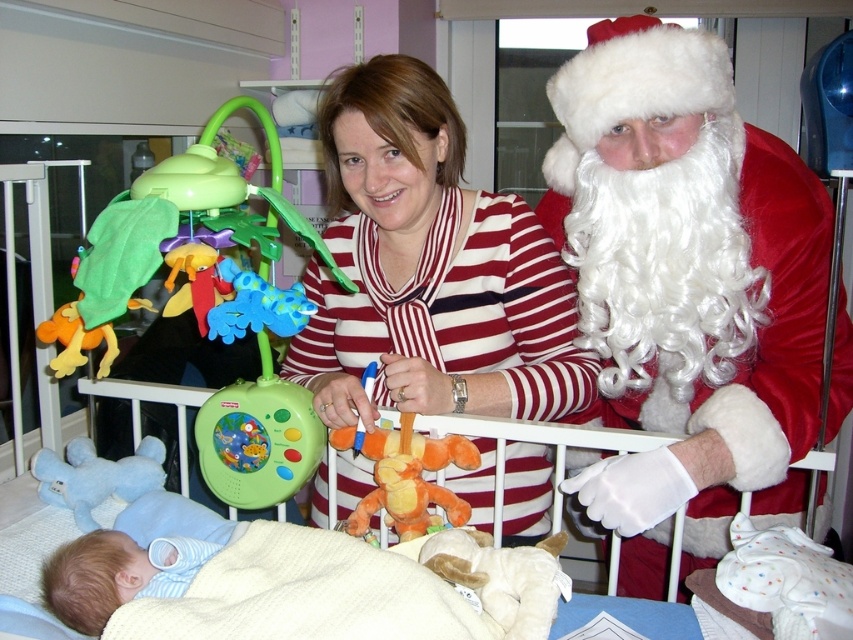
Which is below, green plastic mobile at upper left or plush orange monkey at center?

Positioned lower is plush orange monkey at center.

Does point (260, 381) come closer to viewer compared to point (379, 456)?

No, it is not.

You are a GUI agent. You are given a task and a screenshot of the screen. Output one action in this format:
    pyautogui.click(x=<x>, y=<y>)
    Task: Click on the green plastic mobile at upper left
    
    Given the screenshot: What is the action you would take?
    pyautogui.click(x=218, y=198)

Is plush orange monkey at center below light blue plush bear at lower left?

Actually, plush orange monkey at center is above light blue plush bear at lower left.

Does plush orange monkey at center appear over light blue plush bear at lower left?

Indeed, plush orange monkey at center is positioned over light blue plush bear at lower left.

What are the coordinates of `plush orange monkey at center` in the screenshot? It's located at (410, 480).

Can you confirm if green plastic mobile at upper left is taller than fluffy white teddy bear at center?

Correct, green plastic mobile at upper left is much taller as fluffy white teddy bear at center.

Who is positioned more to the left, green plastic mobile at upper left or fluffy white teddy bear at center?

green plastic mobile at upper left

Describe the element at coordinates (218, 198) in the screenshot. I see `green plastic mobile at upper left` at that location.

At what (x,y) coordinates should I click in order to perform the action: click on green plastic mobile at upper left. Please return your answer as a coordinate pair (x, y). The height and width of the screenshot is (640, 853). Looking at the image, I should click on (218, 198).